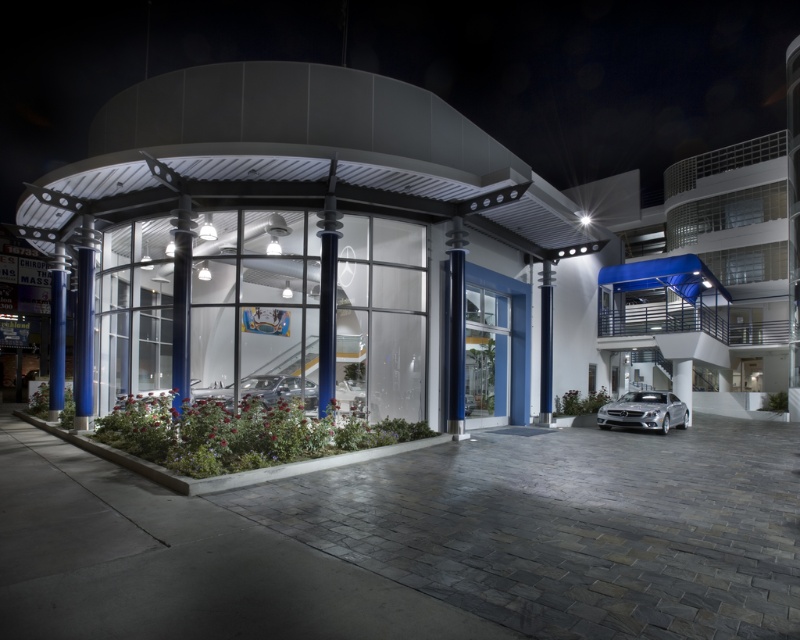
Is point (500, 326) more distant than point (642, 420)?

Yes, point (500, 326) is farther from viewer.

Can you confirm if glassy white car at center is shorter than silver metallic car at lower right?

Incorrect, glassy white car at center's height does not fall short of silver metallic car at lower right's.

Is point (182, 232) positioned behind point (668, 428)?

No, it is not.

Image resolution: width=800 pixels, height=640 pixels. I want to click on glassy white car at center, so click(x=306, y=248).